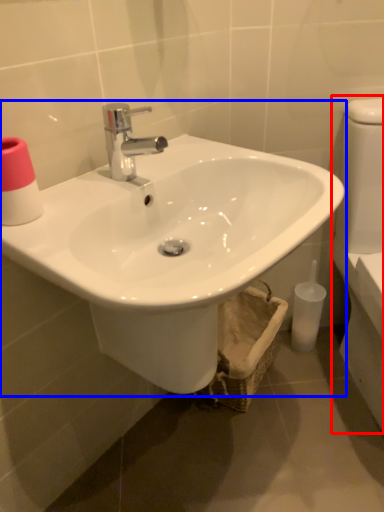
Question: Which of the following is the farthest to the observer, porcelain (highlighted by a red box) or sink (highlighted by a blue box)?

Choices:
 (A) porcelain
 (B) sink

Answer: (A)